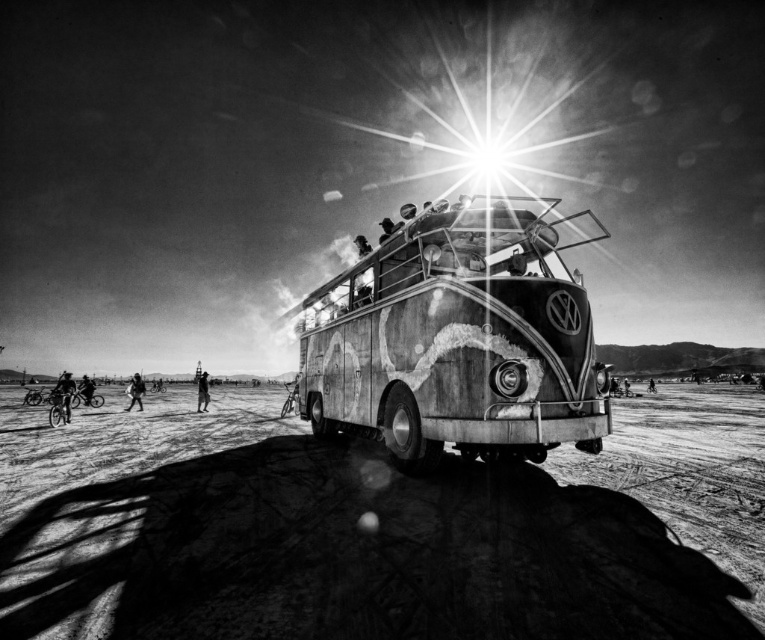
You are a photographer setting up equipment in the desert. You have a limited space between the rusty metal van at center and the dark fabric bicycle at lower left. Can you place a small tripod between them without moving either object?

The rusty metal van at center occupies less space than dark fabric bicycle at lower left, so there might be enough space between them to place a small tripod without moving either object.

You are a photographer at the desert event. You want to capture a photo that includes both the dark skin bicycle rider at lower left and the distressed denim pants at center. Which object should you focus on first to ensure both are in frame?

The dark skin bicycle rider at lower left is shorter than the distressed denim pants at center. To ensure both are in frame, focus on the distressed denim pants at center first, then adjust to include the shorter rider.

You are a photographer standing near the Volkswagen bus and notice two items at the lower left corner of your frame. Which item is positioned closer to you between the dark skin textured pants at lower left and the dark fabric bicycle at lower left?

The dark skin textured pants at lower left are closer to you than the dark fabric bicycle at lower left.